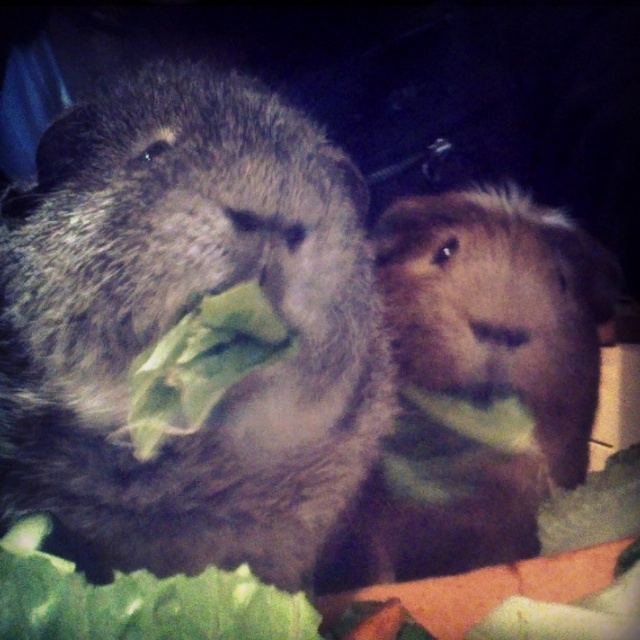
You are a guinea pig owner observing your pets. You notice the fuzzy brown guinea pig at center and the green leafy vegetable at center. Which one is positioned lower in the image?

The fuzzy brown guinea pig at center is positioned below the green leafy vegetable at center, so it is lower in the image.

You are a vet examining two guinea pigs. The fuzzy gray guinea pig at left and the fuzzy brown guinea pig at center are both eating vegetables. Which one is smaller?

The fuzzy gray guinea pig at left is smaller than the fuzzy brown guinea pig at center.